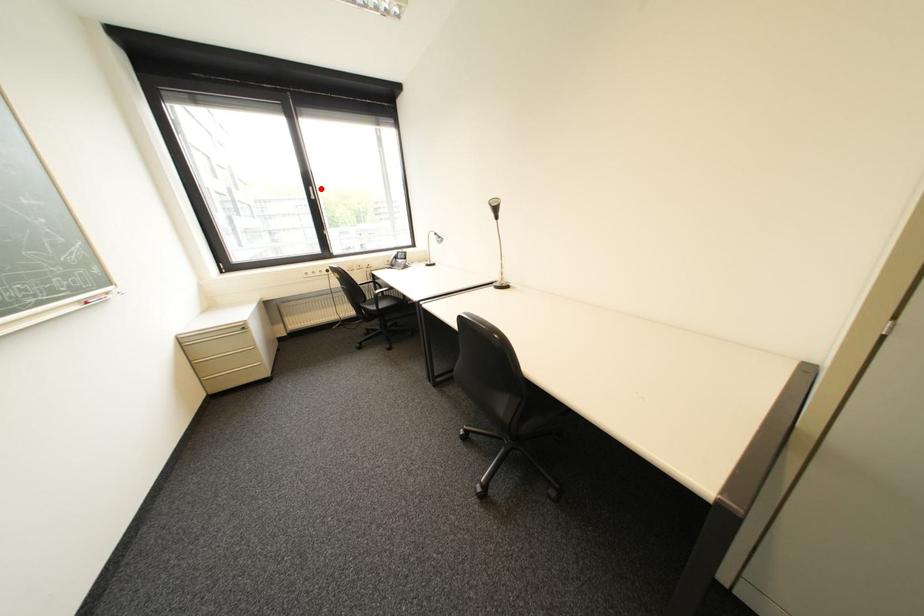
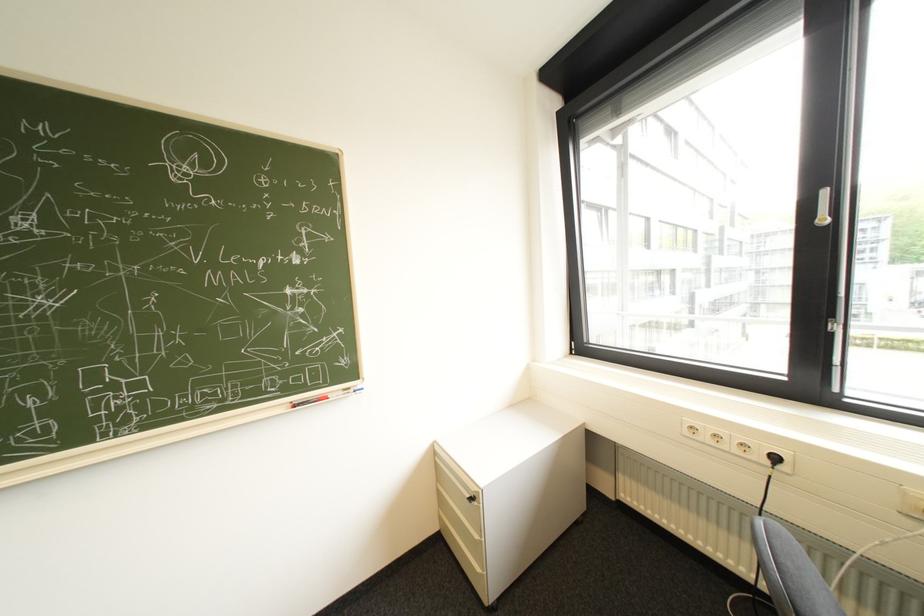
Question: I am providing you with two images of the same scene from different viewpoints. A red point is shown in image1. For the corresponding object point in image2, is it positioned nearer or farther from the camera?

Choices:
 (A) Nearer
 (B) Farther

Answer: (B)